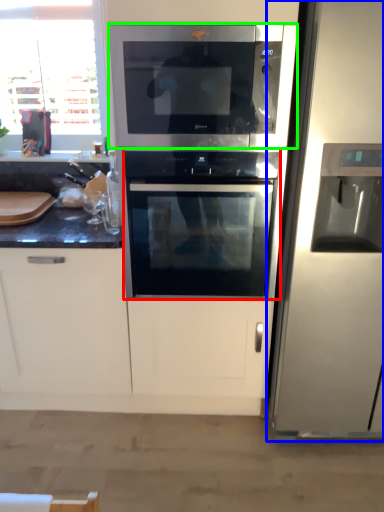
Question: Which object is positioned closest to oven (highlighted by a red box)? Select from refrigerator (highlighted by a blue box) and microwave oven (highlighted by a green box).

Choices:
 (A) refrigerator
 (B) microwave oven

Answer: (B)